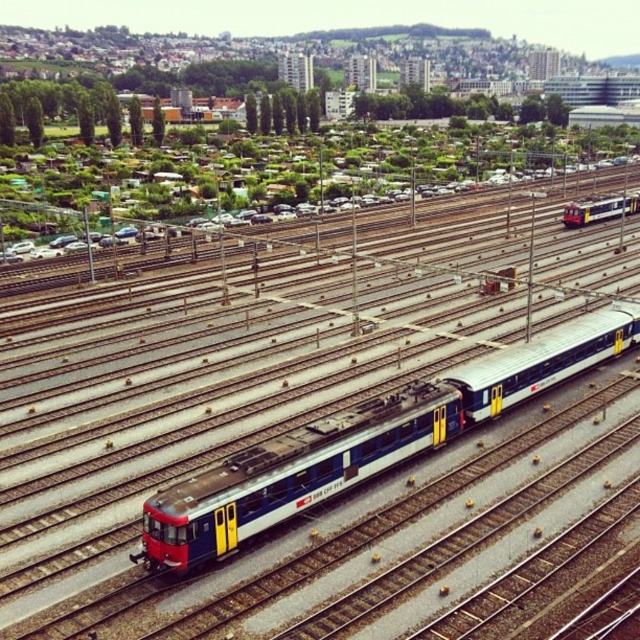
You are a railway engineer inspecting the tracks. You see the matte blue passenger train at center and the matte blue train at center. Which one is positioned lower in the image?

The matte blue passenger train at center is positioned lower than the matte blue train at center.